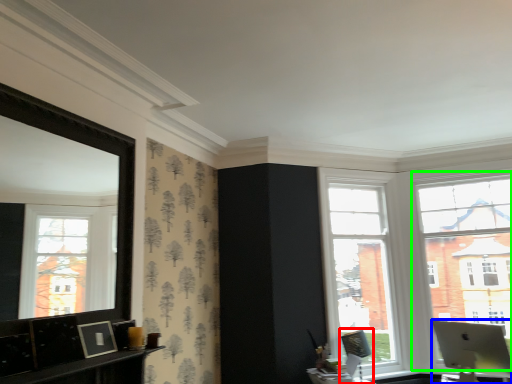
Question: Which object is positioned farthest from swivel chair (highlighted by a red box)? Select from laptop (highlighted by a blue box) and window (highlighted by a green box).

Choices:
 (A) laptop
 (B) window

Answer: (B)